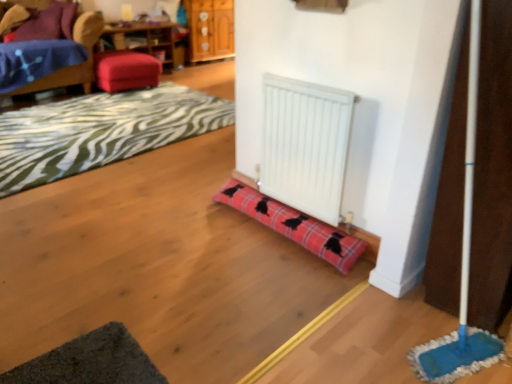
Image resolution: width=512 pixels, height=384 pixels. I want to click on vacant space in front of plaid fabric mat at lower left, so click(x=153, y=221).